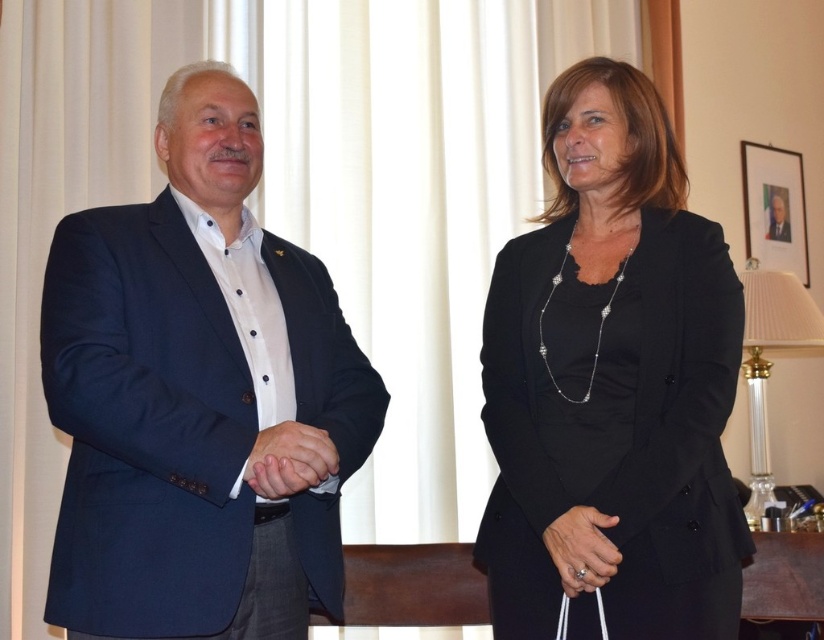
Question: Among these points, which one is nearest to the camera?

Choices:
 (A) (565, 524)
 (B) (254, 481)
 (C) (226, 184)

Answer: (B)

Question: Can you confirm if matte black suit at left is bigger than black satin blazer at center?

Choices:
 (A) no
 (B) yes

Answer: (B)

Question: Is matte black suit at left wider than black satin blazer at center?

Choices:
 (A) no
 (B) yes

Answer: (B)

Question: Can you confirm if black satin blazer at center is positioned to the left of matte black hands at center?

Choices:
 (A) no
 (B) yes

Answer: (A)

Question: Which point appears farthest from the camera in this image?

Choices:
 (A) (738, 353)
 (B) (261, 608)
 (C) (317, 474)

Answer: (B)

Question: Which point is closer to the camera taking this photo?

Choices:
 (A) 260,445
 (B) 722,468
 (C) 206,518

Answer: (C)